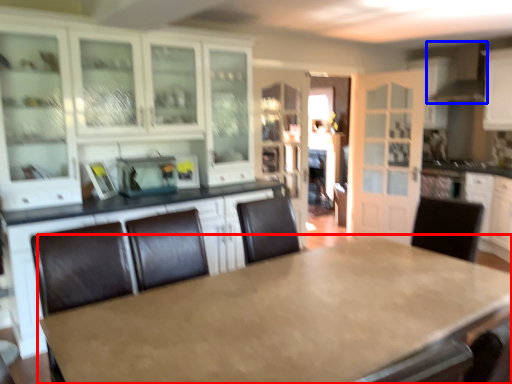
Question: Which point is further to the camera, table (highlighted by a red box) or exhaust hood (highlighted by a blue box)?

Choices:
 (A) table
 (B) exhaust hood

Answer: (B)